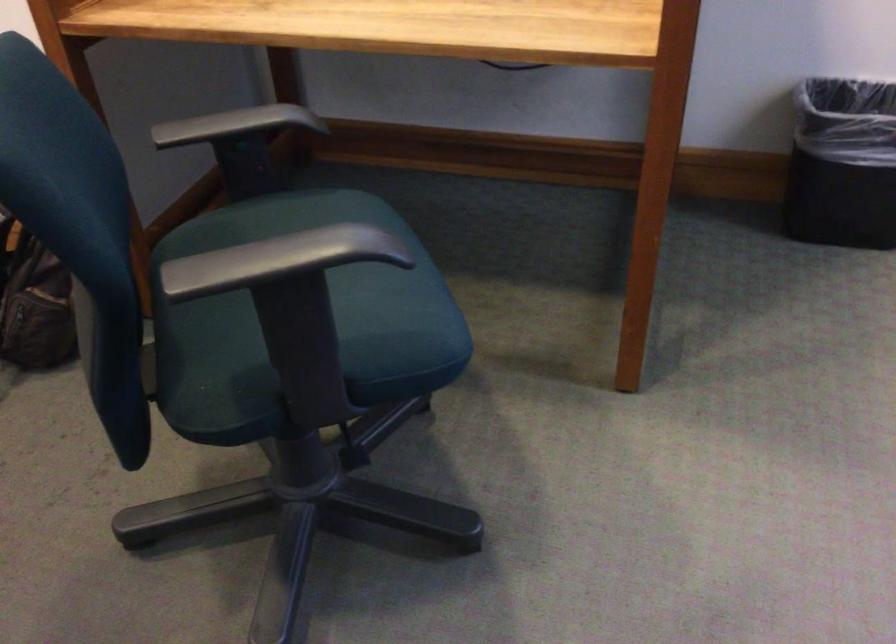
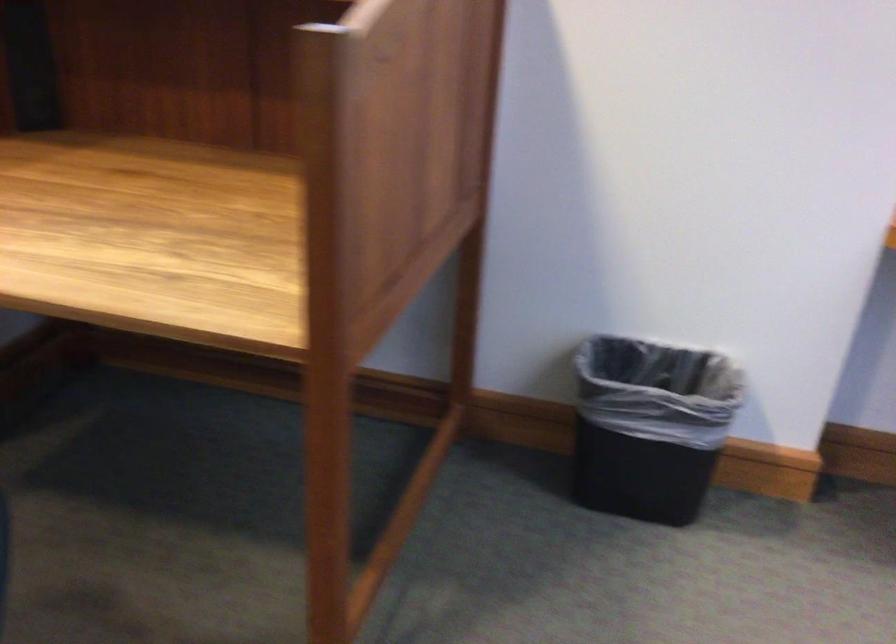
Question: The first image is from the beginning of the video and the second image is from the end. How did the camera likely rotate when shooting the video?

Choices:
 (A) Left
 (B) Right
 (C) Up
 (D) Down

Answer: (C)